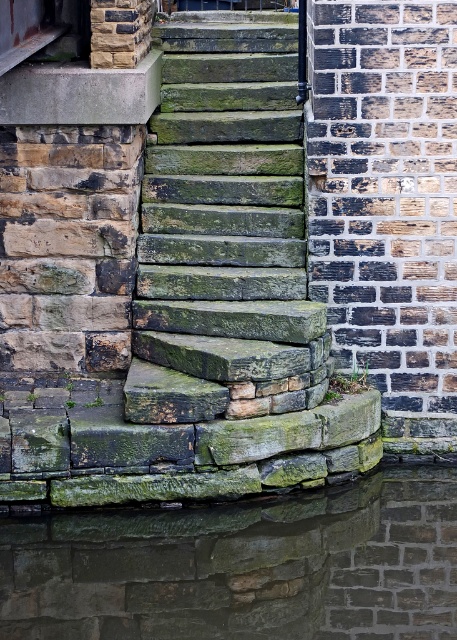
You are a delivery robot with a width of 1 meter. You need to move from the green mossy stone at lower center to the green mossy stone stairs at center. Can you pass through the space between them without any obstacles?

The distance between the green mossy stone at lower center and the green mossy stone stairs at center is 1.32 meters. Since your width is 1 meter, you can pass through the space as it is wider than your robot.

You are standing at the edge of the canal and want to step onto the green mossy stone stairs at center. Based on the coordinates provided, where exactly should you aim to place your foot?

You should aim to place your foot at the coordinates point (224, 234) where the green mossy stone stairs at center are located.

You are a stonemason inspecting the green mossy stone stairs at center and the green mossy stone at lower center. Which one has a larger size?

The green mossy stone stairs at center is bigger than the green mossy stone at lower center.